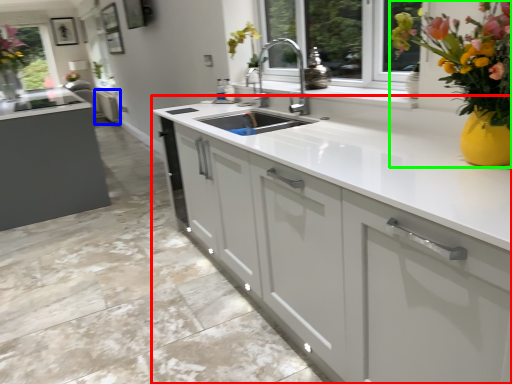
Question: Based on their relative distances, which object is farther from cabinetry (highlighted by a red box)? Choose from cabinetry (highlighted by a blue box) and floral arrangement (highlighted by a green box).

Choices:
 (A) cabinetry
 (B) floral arrangement

Answer: (A)